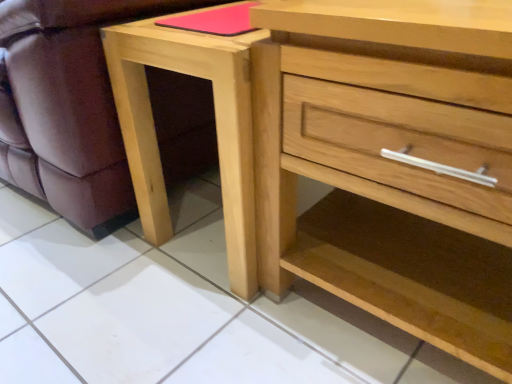
Question: Does natural wood chest of drawers at center have a lesser width compared to matte wood swivel chair at lower left?

Choices:
 (A) no
 (B) yes

Answer: (B)

Question: Is natural wood chest of drawers at center next to matte wood swivel chair at lower left?

Choices:
 (A) no
 (B) yes

Answer: (A)

Question: Does natural wood chest of drawers at center contain matte wood swivel chair at lower left?

Choices:
 (A) yes
 (B) no

Answer: (B)

Question: Considering the relative sizes of natural wood chest of drawers at center and matte wood swivel chair at lower left in the image provided, is natural wood chest of drawers at center shorter than matte wood swivel chair at lower left?

Choices:
 (A) yes
 (B) no

Answer: (B)

Question: Can you confirm if natural wood chest of drawers at center is bigger than matte wood swivel chair at lower left?

Choices:
 (A) no
 (B) yes

Answer: (A)

Question: Does point (269, 158) appear closer or farther from the camera than point (61, 66)?

Choices:
 (A) closer
 (B) farther

Answer: (A)

Question: From a real-world perspective, is natural wood chest of drawers at center positioned above or below matte wood swivel chair at lower left?

Choices:
 (A) below
 (B) above

Answer: (A)

Question: Is natural wood chest of drawers at center to the left or to the right of matte wood swivel chair at lower left in the image?

Choices:
 (A) left
 (B) right

Answer: (B)

Question: Considering their positions, is natural wood chest of drawers at center located in front of or behind matte wood swivel chair at lower left?

Choices:
 (A) behind
 (B) front

Answer: (B)

Question: Is matte wood swivel chair at lower left bigger or smaller than natural wood chest of drawers at center?

Choices:
 (A) big
 (B) small

Answer: (A)

Question: Does point (89, 129) appear closer or farther from the camera than point (402, 51)?

Choices:
 (A) farther
 (B) closer

Answer: (A)

Question: Would you say matte wood swivel chair at lower left is to the left or to the right of natural wood chest of drawers at center in the picture?

Choices:
 (A) left
 (B) right

Answer: (A)

Question: Considering the positions of matte wood swivel chair at lower left and natural wood chest of drawers at center in the image, is matte wood swivel chair at lower left taller or shorter than natural wood chest of drawers at center?

Choices:
 (A) short
 (B) tall

Answer: (A)

Question: Looking at the image, does natural wood chest of drawers at center seem bigger or smaller compared to natural wood nightstand at lower center?

Choices:
 (A) small
 (B) big

Answer: (B)

Question: In terms of height, does natural wood chest of drawers at center look taller or shorter compared to natural wood nightstand at lower center?

Choices:
 (A) short
 (B) tall

Answer: (B)